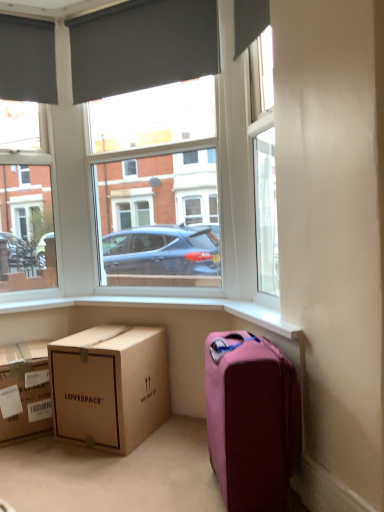
Question: Is point (187, 55) closer or farther from the camera than point (18, 193)?

Choices:
 (A) closer
 (B) farther

Answer: (A)

Question: Considering the positions of dark gray fabric at upper center, positioned as the first curtain in right-to-left order, and matte black window at upper left in the image, is dark gray fabric at upper center, positioned as the first curtain in right-to-left order, wider or thinner than matte black window at upper left?

Choices:
 (A) thin
 (B) wide

Answer: (A)

Question: Based on their relative distances, which object is farther from the brown cardboard box at lower left, the second box from the left?

Choices:
 (A) pink fabric suitcase at lower right
 (B) dark gray matte curtain at upper left, placed as the 2th curtain when sorted from right to left
 (C) brown cardboard box at lower left, the second box viewed from the right
 (D) matte black window at upper left
 (E) white plastic window frame at upper center

Answer: (E)

Question: Which is farther from the pink fabric suitcase at lower right?

Choices:
 (A) brown cardboard box at lower left, the second box from the left
 (B) white plastic window frame at upper center
 (C) matte black window at upper left
 (D) dark gray fabric at upper center, positioned as the first curtain in right-to-left order
 (E) brown cardboard box at lower left, the second box viewed from the right

Answer: (B)